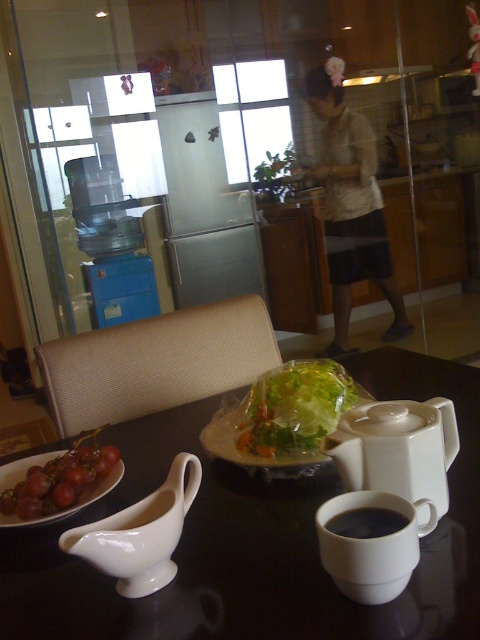
Question: Which point is closer to the camera taking this photo?

Choices:
 (A) (365, 236)
 (B) (354, 522)
 (C) (132, 593)

Answer: (B)

Question: Which object is farther from the camera taking this photo?

Choices:
 (A) translucent plastic salad at center
 (B) matte white platter at lower left
 (C) white glossy table at center

Answer: (A)

Question: Does white glossy table at center have a larger size compared to white cotton shirt at center?

Choices:
 (A) no
 (B) yes

Answer: (A)

Question: Is white matte teapot at center above black matte cup at center?

Choices:
 (A) no
 (B) yes

Answer: (B)

Question: Which object is closer to the camera taking this photo?

Choices:
 (A) white glossy table at center
 (B) translucent plastic salad at center
 (C) white matte teapot at center
 (D) white cotton shirt at center

Answer: (A)

Question: Does white cotton shirt at center appear on the left side of translucent plastic salad at center?

Choices:
 (A) no
 (B) yes

Answer: (A)